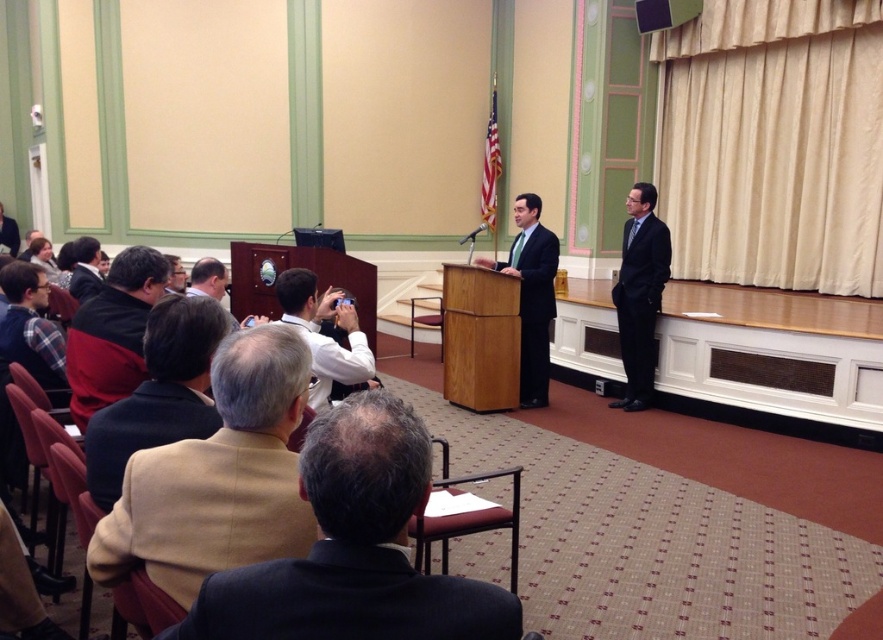
You are organizing a photo shoot in this room and need to position a camera 10 feet away from the white shirt at lower center. Can the camera be placed near the black suit at right without exceeding the 10 feet distance?

The black suit at right is 10.24 feet from the white shirt at lower center. Since the camera needs to be placed 10 feet away, the distance is slightly over by 0.24 feet. Therefore, placing the camera near the black suit at right would exceed the required distance.

You are standing in the conference room and want to move to the point at coordinates point (259,385). If you are 1.6 meters tall, will you be able to see the speaker behind the podium from that point?

The distance between you and the point (259,385) is 1.31 meters. Since you are 1.6 meters tall, you should be able to see the speaker behind the podium from that point as the distance is manageable and your height allows for a clear line of sight.